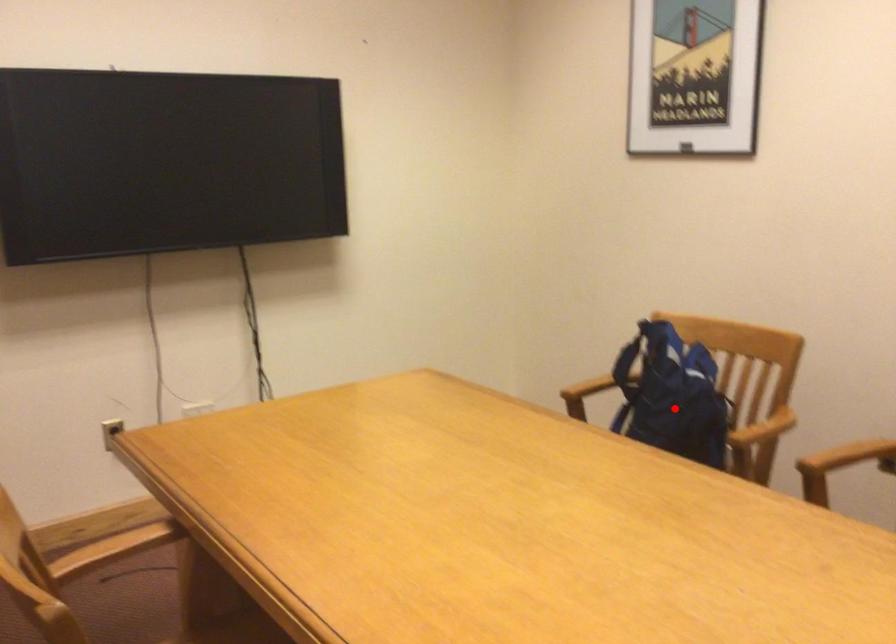
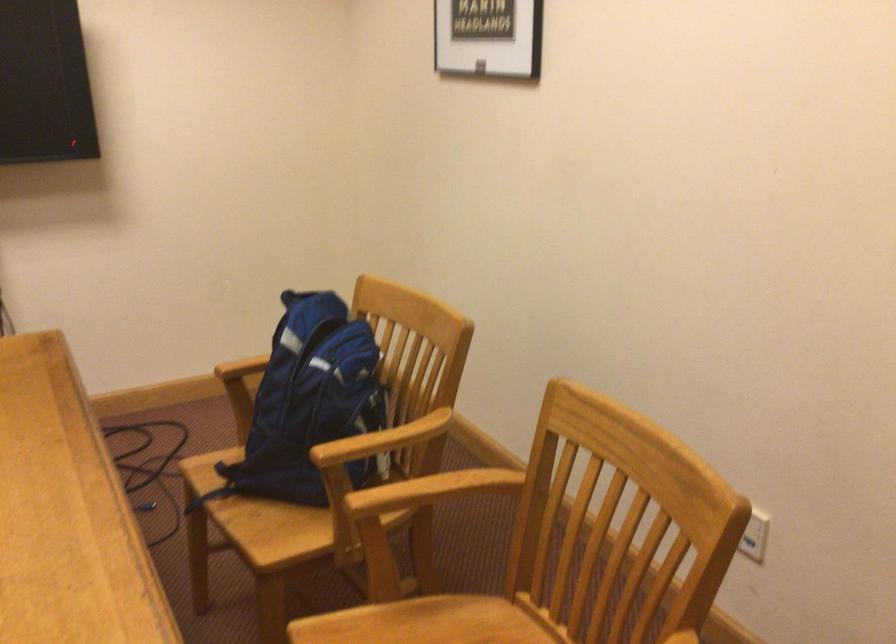
The point at the highlighted location is marked in the first image. Where is the corresponding point in the second image?

(309, 404)